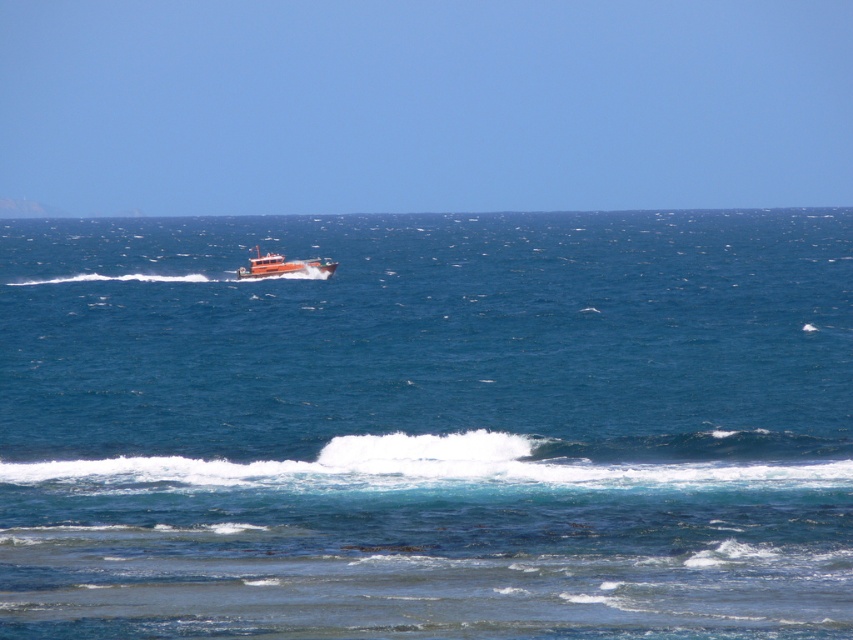
Does point (467, 369) come in front of point (241, 268)?

Yes, it is in front of point (241, 268).

Can you confirm if blue water at center is shorter than orange matte boat at center?

No.

At what (x,y) coordinates should I click in order to perform the action: click on blue water at center. Please return your answer as a coordinate pair (x, y). Looking at the image, I should click on tap(428, 426).

Does white frothy wave at lower center have a lesser height compared to orange matte boat at center?

Yes, white frothy wave at lower center is shorter than orange matte boat at center.

Does white frothy wave at lower center lie in front of orange matte boat at center?

That is True.

I want to click on white frothy wave at lower center, so pos(418,467).

I want to click on white frothy wave at lower center, so click(418, 467).

Who is more forward, (467, 362) or (257, 477)?

Point (257, 477) is more forward.

Can you confirm if blue water at center is thinner than white frothy wave at lower center?

In fact, blue water at center might be wider than white frothy wave at lower center.

Does point (711, 513) come in front of point (701, 483)?

Yes, point (711, 513) is closer to viewer.

Find the location of a particular element. The height and width of the screenshot is (640, 853). blue water at center is located at coordinates click(428, 426).